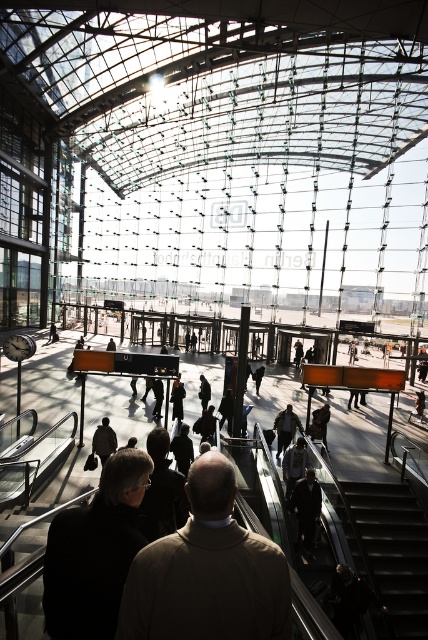
You are a traveler standing at the entrance of the train station. You see a dark gray suit at center and a dark brown leather jacket at lower left. Which clothing item is wider?

The dark gray suit at center is wider than the dark brown leather jacket at lower left.

You are standing at the entrance of the train station and see the point marked at coordinates (389, 552). What object is located at this point?

The point at coordinates (389, 552) corresponds to the black metal escalator at lower right.